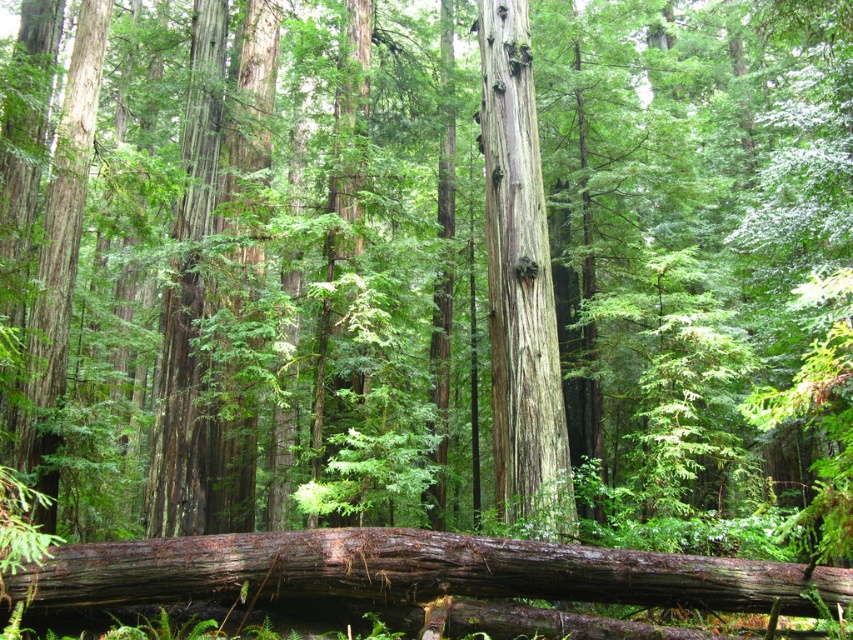
You are a hiker trying to cross the forest floor. You see a rough bark log at center and a smooth gray bark at center. Which one is closer to you?

The rough bark log at center is closer because it is in front of the smooth gray bark at center.

You are an explorer in the forest and need to cross the rough bark log at center and the smooth gray bark at center. Which one is closer to your left side?

The rough bark log at center is to the left of smooth gray bark at center, so the rough bark log at center is closer to your left side.

You are navigating through the dense forest and want to reach a specific location. You have two reference points marked as point (836, 584) and point (526, 314). Which point should you head towards first if you want to reach the one that is closer to your current position?

Point (836, 584) is in front of point (526, 314), so if you want to reach the one closer to your current position, you should head towards point (836, 584) first.